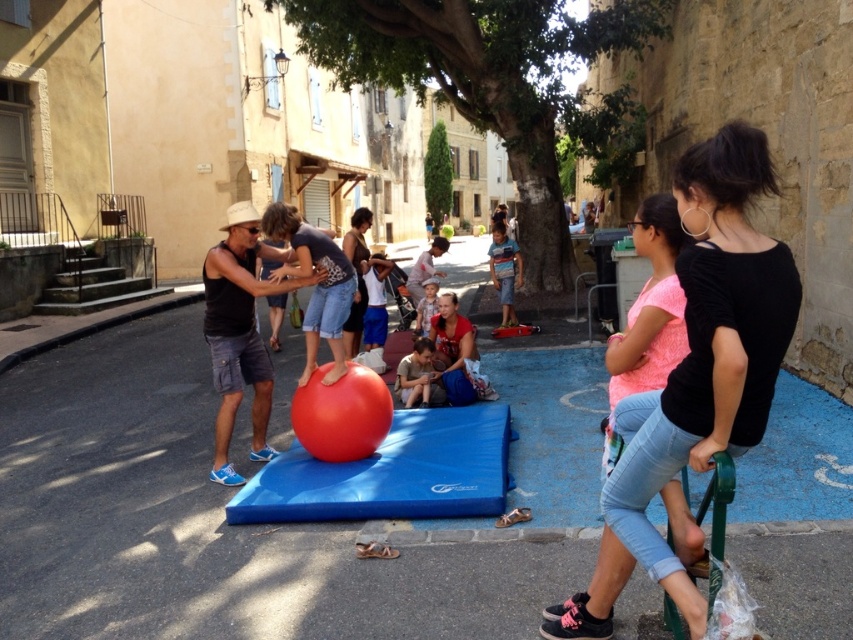
You are a photographer standing in the alleyway and want to take a photo of the smooth skin child at center and the light brown wooden chair at center. To ensure both are in the frame, should you position yourself to the left or right of the chair?

You should position yourself to the right of the light brown wooden chair at center because the smooth skin child at center is to the left of the chair, so placing yourself to the right will allow both to be captured in the frame.